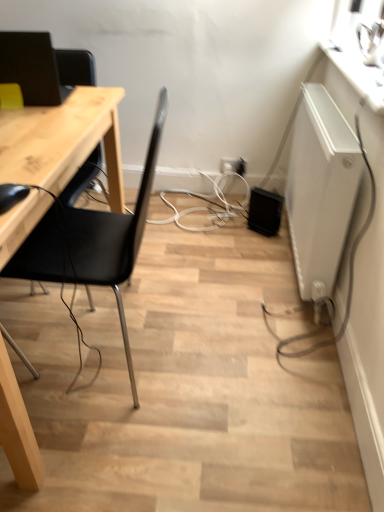
You are a GUI agent. You are given a task and a screenshot of the screen. Output one action in this format:
    pyautogui.click(x=<x>, y=<y>)
    Task: Click on the free space that is in between black matte chair at left and white matte radiator at right
    The image size is (384, 512).
    Given the screenshot: What is the action you would take?
    pyautogui.click(x=225, y=288)